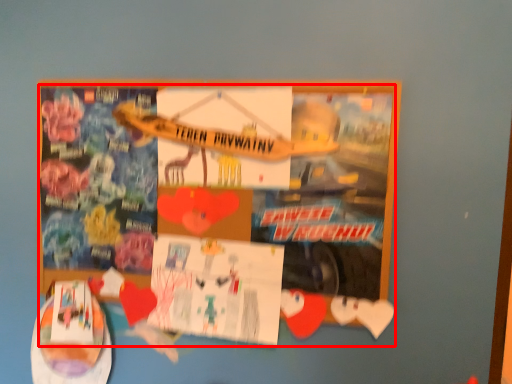
Question: From the image's perspective, what is the correct spatial relationship of poster (annotated by the red box) in relation to flyer?

Choices:
 (A) above
 (B) below

Answer: (A)